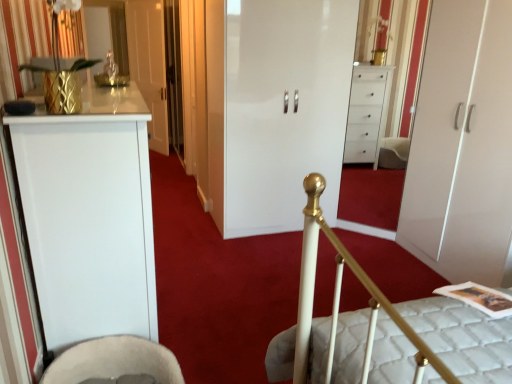
Question: Could white glossy wardrobe at center, which appears as the third door when viewed from the left, be considered to be inside beige fabric rocking chair at lower left?

Choices:
 (A) no
 (B) yes

Answer: (A)

Question: Could you tell me if beige fabric rocking chair at lower left is turned towards white glossy wardrobe at center, which appears as the third door when viewed from the left?

Choices:
 (A) no
 (B) yes

Answer: (B)

Question: From the image's perspective, would you say beige fabric rocking chair at lower left is shown under white glossy wardrobe at center, which appears as the third door when viewed from the left?

Choices:
 (A) yes
 (B) no

Answer: (A)

Question: Is beige fabric rocking chair at lower left in contact with white glossy wardrobe at center, acting as the first door starting from the right?

Choices:
 (A) yes
 (B) no

Answer: (B)

Question: Is beige fabric rocking chair at lower left outside of white glossy wardrobe at center, acting as the 3th door starting from the back?

Choices:
 (A) no
 (B) yes

Answer: (B)

Question: From a real-world perspective, is beige fabric rocking chair at lower left physically below white glossy wardrobe at center, which appears as the third door when viewed from the left?

Choices:
 (A) no
 (B) yes

Answer: (B)

Question: Does white glossy cabinet at center, placed as the 2th door when sorted from front to back, have a larger size compared to gold textured pineapple at upper left?

Choices:
 (A) no
 (B) yes

Answer: (B)

Question: Is white glossy cabinet at center, which is the 2th door from left to right, thinner than gold textured pineapple at upper left?

Choices:
 (A) yes
 (B) no

Answer: (B)

Question: Is gold textured pineapple at upper left completely or partially inside white glossy cabinet at center, placed as the 2th door when sorted from front to back?

Choices:
 (A) yes
 (B) no

Answer: (B)

Question: Does white glossy cabinet at center, placed as the 2th door when sorted from front to back, lie behind gold textured pineapple at upper left?

Choices:
 (A) no
 (B) yes

Answer: (B)

Question: Is white glossy cabinet at center, which is the 2th door from left to right, not close to gold textured pineapple at upper left?

Choices:
 (A) no
 (B) yes

Answer: (B)

Question: From a real-world perspective, is white glossy cabinet at center, which is the 2th door from left to right, located higher than gold textured pineapple at upper left?

Choices:
 (A) no
 (B) yes

Answer: (A)

Question: Considering the relative sizes of gold textured pineapple at upper left and beige fabric rocking chair at lower left in the image provided, is gold textured pineapple at upper left smaller than beige fabric rocking chair at lower left?

Choices:
 (A) yes
 (B) no

Answer: (A)